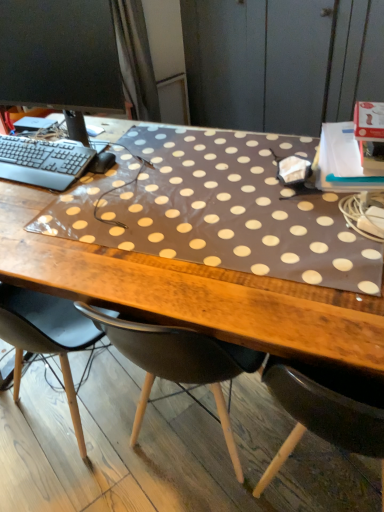
Locate an element on the screen. This screenshot has height=512, width=384. vacant space behind black matte mouse at center is located at coordinates (132, 136).